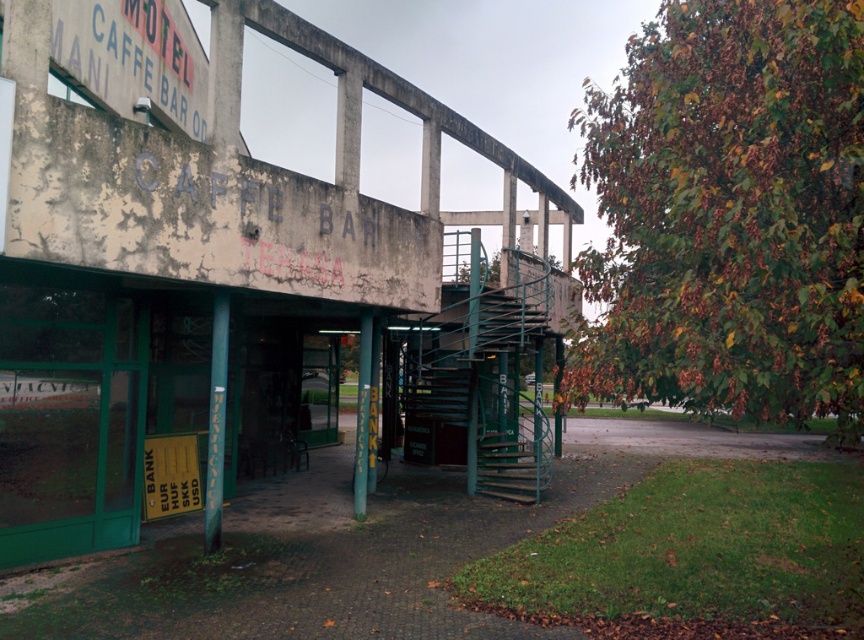
Based on the photo, measure the distance between weathered concrete sign at upper left and green metal staircase at lower center.

weathered concrete sign at upper left and green metal staircase at lower center are 24.04 feet apart from each other.

Does point (150, 4) come behind point (537, 500)?

No, it is in front of (537, 500).

Where is `weathered concrete sign at upper left`? weathered concrete sign at upper left is located at coordinates click(x=132, y=58).

Between point (518, 480) and point (175, 451), which one is positioned behind?

The point (518, 480) is behind.

Find the location of a particular element. green metal staircase at lower center is located at coordinates (512, 465).

Find the location of a particular element. green metal staircase at lower center is located at coordinates (512, 465).

Measure the distance from weathered concrete sign at upper left to yellow plastic sign at lower left.

weathered concrete sign at upper left is 4.51 meters away from yellow plastic sign at lower left.

Can you confirm if weathered concrete sign at upper left is bigger than yellow plastic sign at lower left?

Correct, weathered concrete sign at upper left is larger in size than yellow plastic sign at lower left.

Who is more forward, (74,3) or (175,513)?

Positioned in front is point (74,3).

Where is `weathered concrete sign at upper left`? This screenshot has width=864, height=640. weathered concrete sign at upper left is located at coordinates (132, 58).